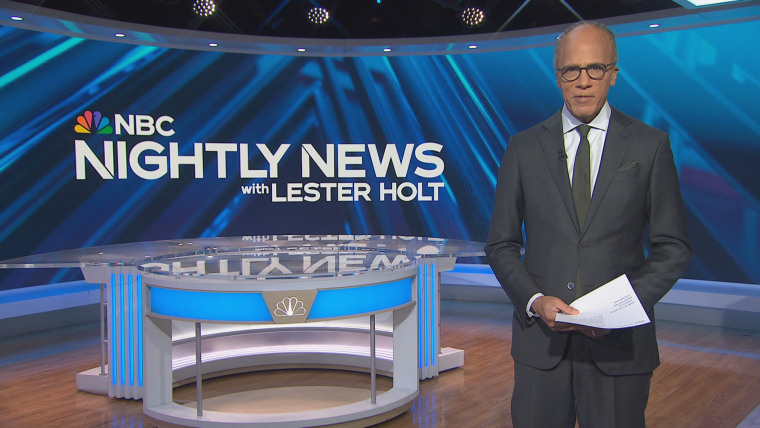
Identify the location of screen. This screenshot has width=760, height=428. (233, 69).